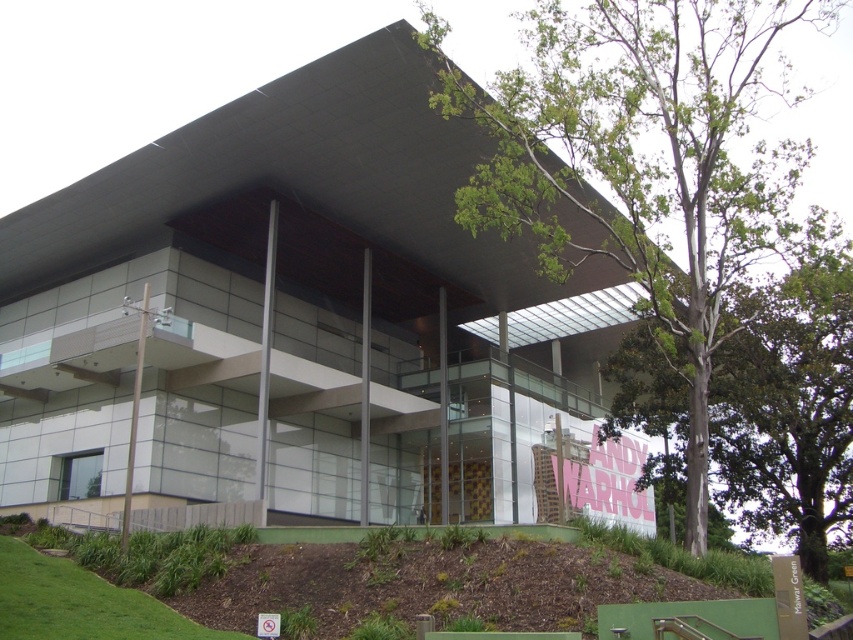
You are standing in front of the modern architectural structure and notice the brown mulch at lower center and the green leafy tree at right. Which object is taller when observed from the ground level?

The green leafy tree at right is taller than the brown mulch at lower center.

From the picture: You are a landscape architect planning to install a new pathway between the brown mulch at lower center and the green leafy tree at right. What is the minimum length the pathway needs to be to connect them directly?

The pathway needs to be at least 13.34 meters long to connect the brown mulch at lower center and the green leafy tree at right directly.